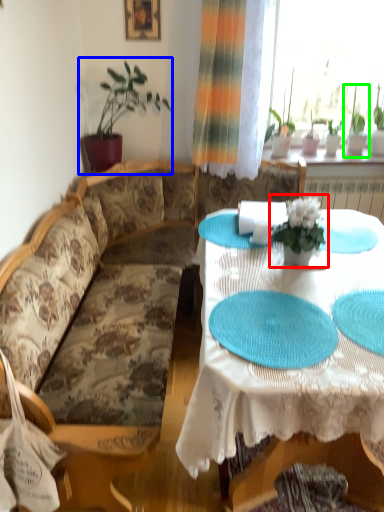
Question: Estimate the real-world distances between objects in this image. Which object is closer to houseplant (highlighted by a red box), houseplant (highlighted by a blue box) or houseplant (highlighted by a green box)?

Choices:
 (A) houseplant
 (B) houseplant

Answer: (A)